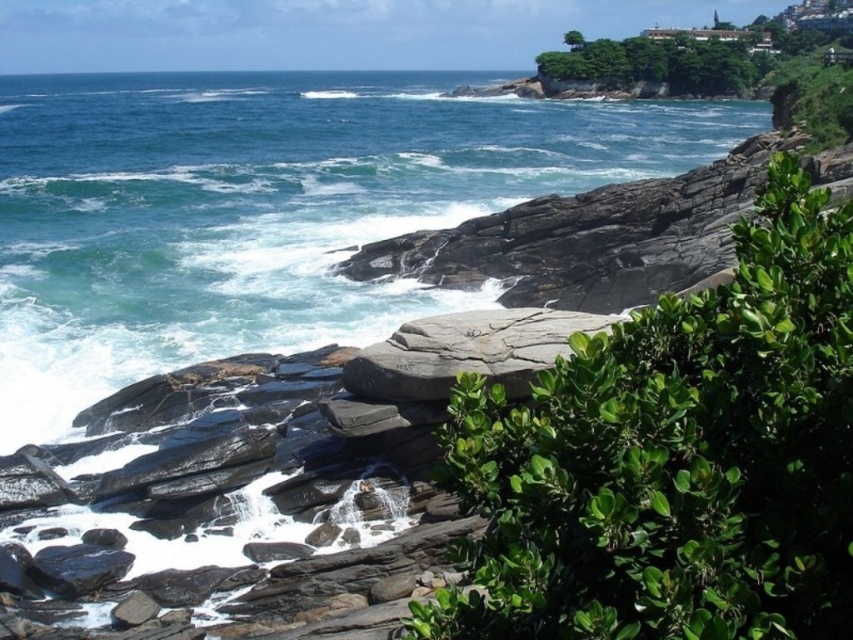
Question: Does blue water at upper left appear over gray rock at center?

Choices:
 (A) yes
 (B) no

Answer: (A)

Question: Which point is closer to the camera?

Choices:
 (A) coord(527,349)
 (B) coord(157,218)

Answer: (A)

Question: Is blue water at upper left positioned before gray rock at center?

Choices:
 (A) no
 (B) yes

Answer: (A)

Question: Is blue water at upper left smaller than gray rock at center?

Choices:
 (A) yes
 (B) no

Answer: (B)